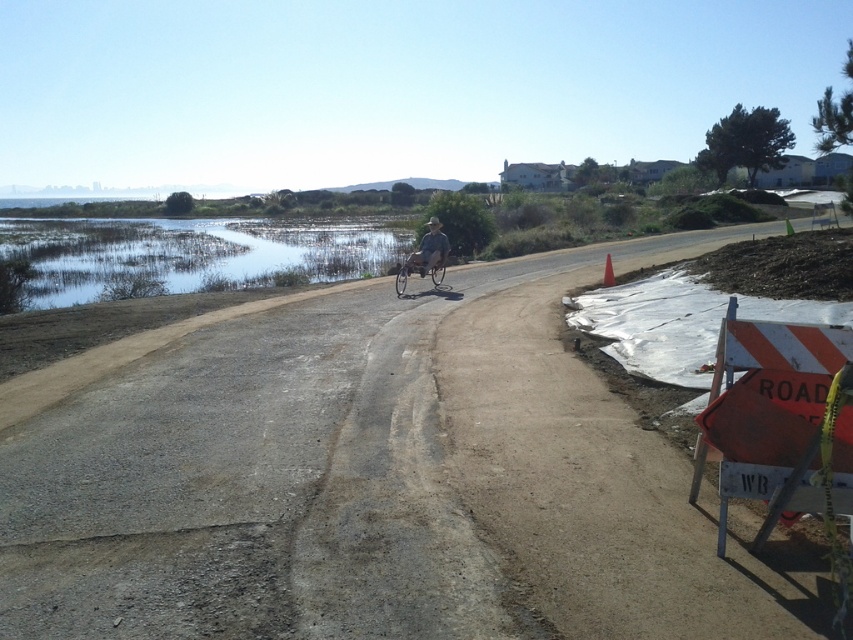
Question: Which object is closer to the camera taking this photo?

Choices:
 (A) camouflage fabric shirt at center
 (B) clear water at center
 (C) silver metallic bicycle at center
 (D) dull gray asphalt at center

Answer: (D)

Question: Which object appears farthest from the camera in this image?

Choices:
 (A) camouflage fabric shirt at center
 (B) dull gray asphalt at center

Answer: (A)

Question: Is clear water at center below camouflage fabric shirt at center?

Choices:
 (A) no
 (B) yes

Answer: (A)

Question: Is the position of camouflage fabric shirt at center more distant than that of silver metallic bicycle at center?

Choices:
 (A) no
 (B) yes

Answer: (B)

Question: Is the position of clear water at center more distant than that of camouflage fabric shirt at center?

Choices:
 (A) yes
 (B) no

Answer: (A)

Question: Which of the following is the farthest from the observer?

Choices:
 (A) clear water at center
 (B) camouflage fabric shirt at center

Answer: (A)